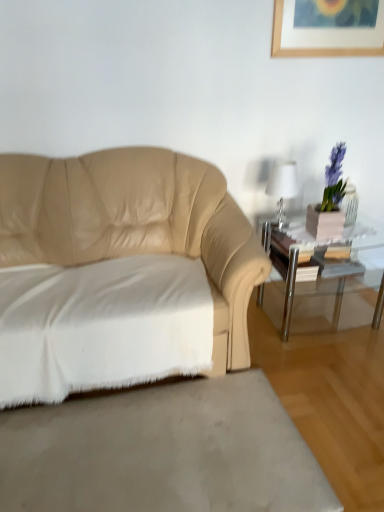
Locate an element on the screen. The width and height of the screenshot is (384, 512). white cotton sheet at lower left is located at coordinates (101, 326).

The image size is (384, 512). What do you see at coordinates (328, 264) in the screenshot?
I see `clear glass table at right` at bounding box center [328, 264].

What do you see at coordinates (120, 272) in the screenshot? I see `beige leather couch at left` at bounding box center [120, 272].

I want to click on white cotton sheet at lower left, so click(101, 326).

Could you tell me if white glossy table lamp at upper right is facing clear glass table at right?

No, white glossy table lamp at upper right is not facing towards clear glass table at right.

Does white glossy table lamp at upper right have a smaller size compared to clear glass table at right?

Yes.

The height and width of the screenshot is (512, 384). I want to click on table that is below the white glossy table lamp at upper right (from the image's perspective), so click(x=328, y=264).

Which is farther, (274,194) or (274,242)?

Positioned behind is point (274,242).

The height and width of the screenshot is (512, 384). I want to click on concrete below the clear glass table at right (from the image's perspective), so tap(162, 452).

Considering the relative sizes of white soft rug at lower left and clear glass table at right in the image provided, is white soft rug at lower left thinner than clear glass table at right?

Incorrect, the width of white soft rug at lower left is not less than that of clear glass table at right.

Is point (251, 475) closer to viewer compared to point (377, 270)?

Yes.

Consider the image. Would you say white soft rug at lower left is a long distance from clear glass table at right?

No, white soft rug at lower left is not far from clear glass table at right.

Identify the location of table below the white cotton sheet at lower left (from a real-world perspective). The height and width of the screenshot is (512, 384). (328, 264).

Is clear glass table at right in contact with white cotton sheet at lower left?

clear glass table at right and white cotton sheet at lower left are clearly separated.

Looking at this image, how different are the orientations of clear glass table at right and white cotton sheet at lower left in degrees?

They differ by 0.957 degrees in their facing directions.

Relative to white glossy table lamp at upper right, is beige leather couch at left in front or behind?

Visually, beige leather couch at left is located in front of white glossy table lamp at upper right.

Is beige leather couch at left not inside white glossy table lamp at upper right?

Yes, beige leather couch at left is outside of white glossy table lamp at upper right.

I want to click on table lamp that appears above the beige leather couch at left (from a real-world perspective), so click(282, 185).

Considering the positions of objects beige leather couch at left and white glossy table lamp at upper right in the image provided, who is more to the left, beige leather couch at left or white glossy table lamp at upper right?

beige leather couch at left.

Is clear glass table at right thinner than beige leather couch at left?

Yes.

Who is taller, clear glass table at right or beige leather couch at left?

Standing taller between the two is beige leather couch at left.

Between clear glass table at right and beige leather couch at left, which one is positioned in front?

Positioned in front is beige leather couch at left.

Is white cotton sheet at lower left in front of white glossy table lamp at upper right?

Yes, it is.

From the picture: Is white cotton sheet at lower left looking in the opposite direction of white glossy table lamp at upper right?

No.

Which is less distant, (9,283) or (278,162)?

Clearly, point (9,283) is closer to the camera than point (278,162).

Is white glossy table lamp at upper right not near white cotton sheet at lower left?

Indeed, white glossy table lamp at upper right is not near white cotton sheet at lower left.

From a real-world perspective, is white glossy table lamp at upper right beneath white cotton sheet at lower left?

No.

Where is `sheet below the white glossy table lamp at upper right (from a real-world perspective)`? sheet below the white glossy table lamp at upper right (from a real-world perspective) is located at coordinates (101, 326).

Considering the points (279, 185) and (112, 295), which point is behind, point (279, 185) or point (112, 295)?

The point (279, 185) is more distant.

The image size is (384, 512). I want to click on table that is in front of the white glossy table lamp at upper right, so click(x=328, y=264).

Find the location of a particular element. The image size is (384, 512). concrete on the left side of clear glass table at right is located at coordinates (162, 452).

Looking at the image, which one is located closer to beige leather couch at left, white cotton sheet at lower left or white glossy table lamp at upper right?

white cotton sheet at lower left lies closer to beige leather couch at left than the other object.

Which object lies nearer to the anchor point beige leather couch at left, white cotton sheet at lower left or white soft rug at lower left?

white cotton sheet at lower left lies closer to beige leather couch at left than the other object.

Looking at the image, which one is located further to white glossy table lamp at upper right, clear glass table at right or white soft rug at lower left?

white soft rug at lower left is positioned further to the anchor white glossy table lamp at upper right.

Based on their spatial positions, is beige leather couch at left or white soft rug at lower left further from white glossy table lamp at upper right?

white soft rug at lower left.

Based on their spatial positions, is white glossy table lamp at upper right or clear glass table at right further from white cotton sheet at lower left?

The object further to white cotton sheet at lower left is white glossy table lamp at upper right.

Which object lies nearer to the anchor point white soft rug at lower left, clear glass table at right or white glossy table lamp at upper right?

clear glass table at right lies closer to white soft rug at lower left than the other object.

Estimate the real-world distances between objects in this image. Which object is closer to white cotton sheet at lower left, beige leather couch at left or white glossy table lamp at upper right?

beige leather couch at left.

Estimate the real-world distances between objects in this image. Which object is closer to white glossy table lamp at upper right, beige leather couch at left or clear glass table at right?

Among the two, clear glass table at right is located nearer to white glossy table lamp at upper right.

This screenshot has height=512, width=384. Find the location of `sheet between white glossy table lamp at upper right and white soft rug at lower left from top to bottom`. sheet between white glossy table lamp at upper right and white soft rug at lower left from top to bottom is located at coordinates (101, 326).

Where is `table between white glossy table lamp at upper right and white soft rug at lower left vertically`? This screenshot has height=512, width=384. table between white glossy table lamp at upper right and white soft rug at lower left vertically is located at coordinates (328, 264).

Identify the location of table between beige leather couch at left and white glossy table lamp at upper right along the z-axis. [x=328, y=264].

Identify the location of sheet between beige leather couch at left and clear glass table at right along the z-axis. The width and height of the screenshot is (384, 512). (101, 326).